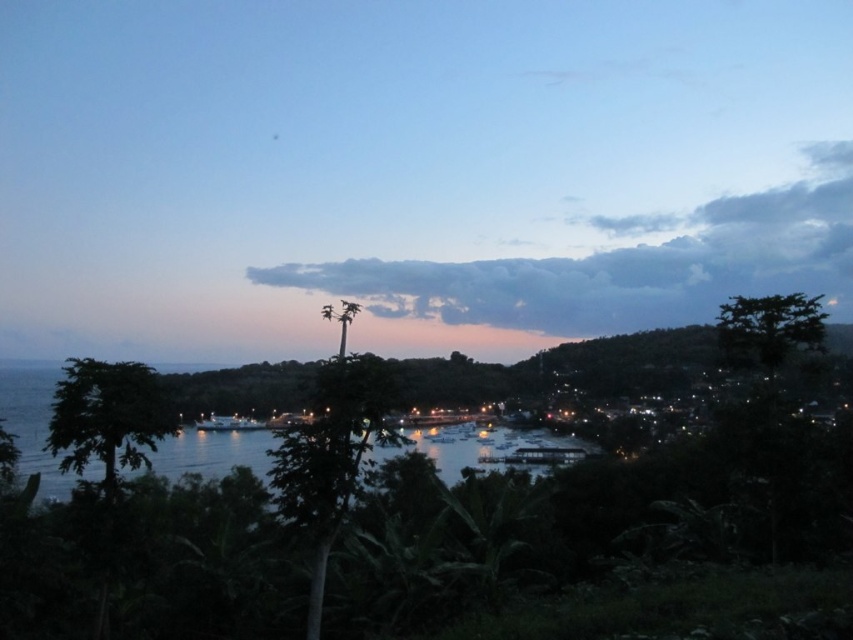
Question: Which of the following is the farthest from the observer?

Choices:
 (A) (103, 464)
 (B) (271, 486)

Answer: (A)

Question: Is the position of green leafy tree at center more distant than that of green leafy tree at left?

Choices:
 (A) yes
 (B) no

Answer: (B)

Question: Where is green leafy tree at center located in relation to green leafy tree at left in the image?

Choices:
 (A) right
 (B) left

Answer: (A)

Question: Does green leafy tree at center appear under green leafy tree at left?

Choices:
 (A) no
 (B) yes

Answer: (B)

Question: Which point is closer to the camera?

Choices:
 (A) (328, 385)
 (B) (165, 428)

Answer: (A)